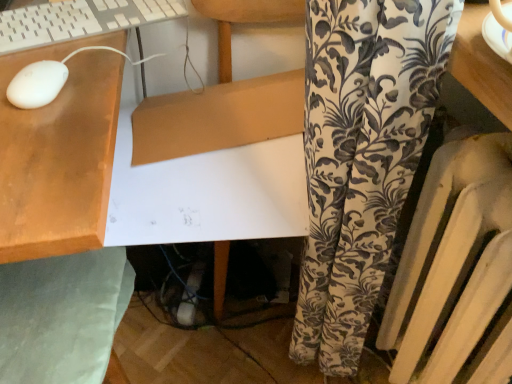
Find the location of a particular element. The image size is (512, 384). vacant region above green fabric swivel chair at lower left (from a real-world perspective) is located at coordinates (61, 312).